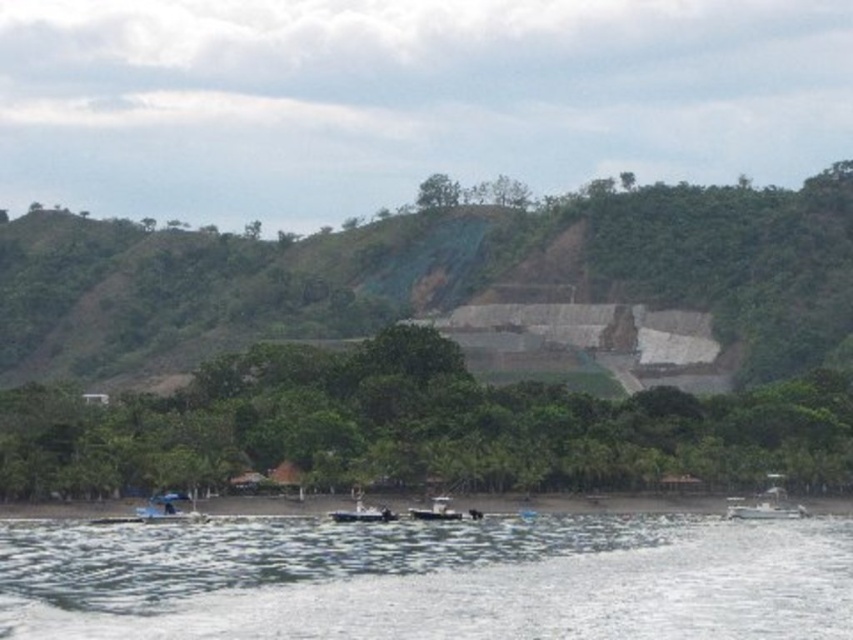
Who is shorter, white plastic boat at lower center or metallic gray boat at center?

Standing shorter between the two is metallic gray boat at center.

Is point (341, 518) farther from viewer compared to point (445, 515)?

No, (341, 518) is in front of (445, 515).

Find the location of a particular element. white plastic boat at lower center is located at coordinates (363, 512).

Is point (759, 497) behind point (447, 502)?

Yes.

Is white plastic boat at lower right positioned behind metallic gray boat at center?

Yes.

Is point (775, 516) farther from viewer compared to point (415, 513)?

Yes, it is behind point (415, 513).

Find the location of a particular element. white plastic boat at lower right is located at coordinates (766, 506).

In the scene shown: Who is higher up, white plastic boat at lower right or white plastic boat at lower center?

white plastic boat at lower center

Can you confirm if white plastic boat at lower right is positioned to the left of white plastic boat at lower center?

Incorrect, white plastic boat at lower right is not on the left side of white plastic boat at lower center.

Locate an element on the screen. The width and height of the screenshot is (853, 640). white plastic boat at lower right is located at coordinates (766, 506).